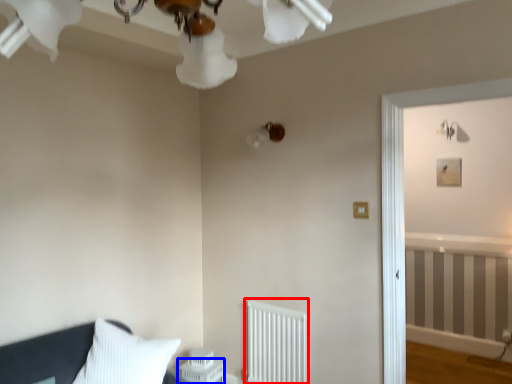
Question: Which object appears farthest to the camera in this image, radiator (highlighted by a red box) or table (highlighted by a blue box)?

Choices:
 (A) radiator
 (B) table

Answer: (B)